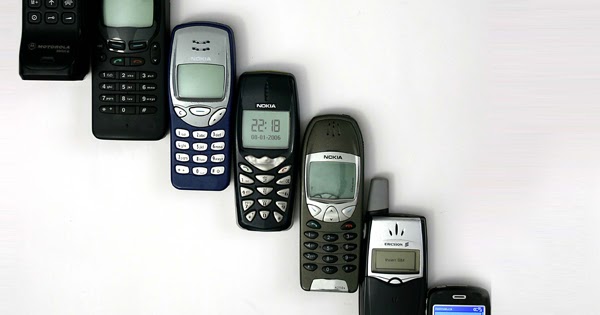
This screenshot has height=315, width=600. What are the coordinates of `phone screen` in the screenshot? It's located at (456, 308), (396, 259), (332, 175), (265, 128), (196, 80), (133, 10).